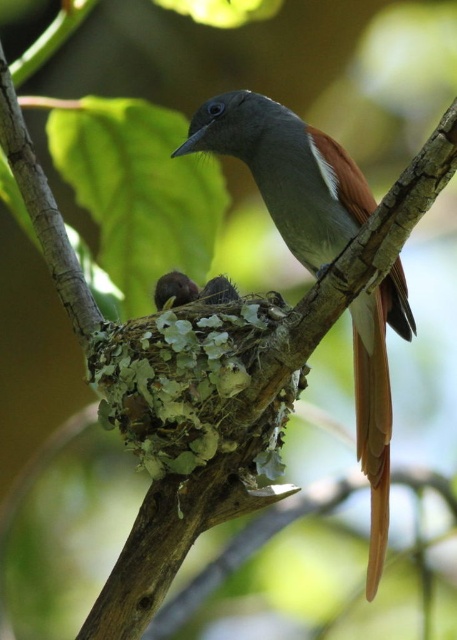
You are observing a bird in the image. Where exactly is the brown glossy bird at center positioned in terms of coordinates?

The brown glossy bird at center is located at point coordinates of [287,172].

Looking at this image, you are a photographer trying to capture the brown glossy bird at center and the brown feathered nest at center in the same frame. Which one will appear larger in your photo?

The brown glossy bird at center will appear larger in the photo because it is closer to the viewer than the brown feathered nest at center.